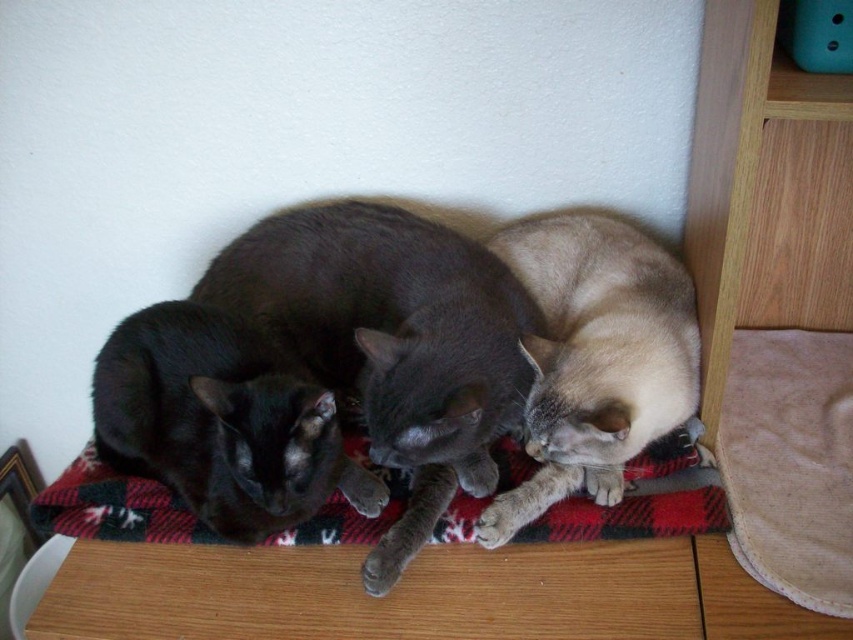
Can you confirm if black fur cat at left is bigger than satin beige cat at lower right?

Incorrect, black fur cat at left is not larger than satin beige cat at lower right.

The height and width of the screenshot is (640, 853). What do you see at coordinates (221, 420) in the screenshot? I see `black fur cat at left` at bounding box center [221, 420].

Where is `black fur cat at left`? Image resolution: width=853 pixels, height=640 pixels. black fur cat at left is located at coordinates (221, 420).

Can you confirm if satin beige cat at lower right is positioned to the left of red plaid fabric at center?

In fact, satin beige cat at lower right is to the right of red plaid fabric at center.

How much distance is there between satin beige cat at lower right and red plaid fabric at center?

satin beige cat at lower right is 6.02 inches from red plaid fabric at center.

Who is more forward, (668,387) or (77,492)?

Point (668,387) is in front.

Locate an element on the screen. This screenshot has width=853, height=640. satin beige cat at lower right is located at coordinates (595, 358).

Which is above, shiny black cat at center or red plaid fabric at center?

Positioned higher is shiny black cat at center.

Is shiny black cat at center positioned before red plaid fabric at center?

Yes, it is in front of red plaid fabric at center.

Does point (368, 554) lie behind point (653, 484)?

No, it is not.

Locate an element on the screen. This screenshot has height=640, width=853. shiny black cat at center is located at coordinates (392, 342).